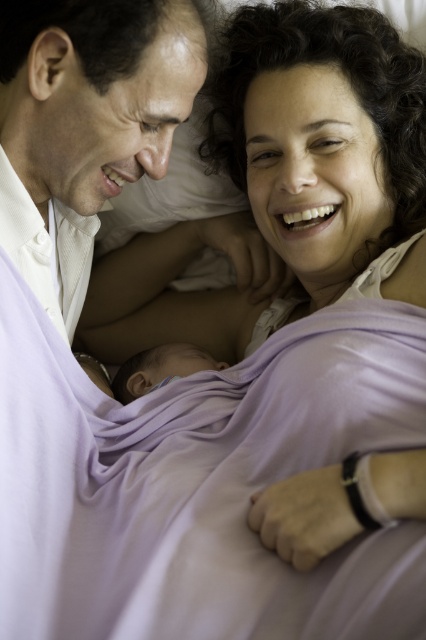
Question: Can you confirm if white satin shirt at upper left is positioned to the right of smooth purple blanket at center?

Choices:
 (A) yes
 (B) no

Answer: (B)

Question: Which point is closer to the camera?

Choices:
 (A) (126, 29)
 (B) (155, 376)

Answer: (A)

Question: Is white satin shirt at upper left wider than smooth purple blanket at center?

Choices:
 (A) no
 (B) yes

Answer: (B)

Question: Is white satin shirt at upper left smaller than smooth purple blanket at center?

Choices:
 (A) no
 (B) yes

Answer: (A)

Question: Which point is closer to the camera?

Choices:
 (A) (26, 188)
 (B) (120, 392)

Answer: (A)

Question: Which point is farther to the camera?

Choices:
 (A) (164, 28)
 (B) (219, 365)

Answer: (B)